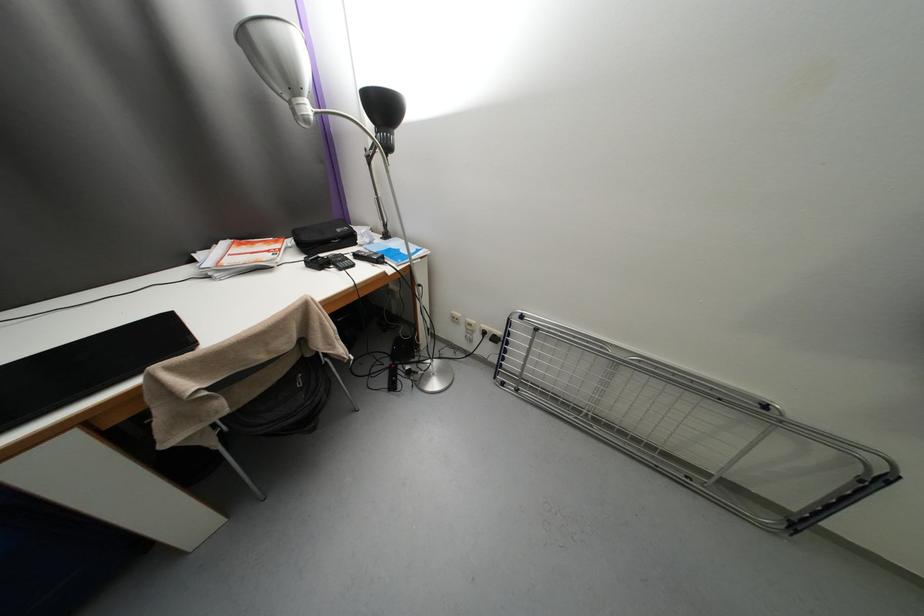
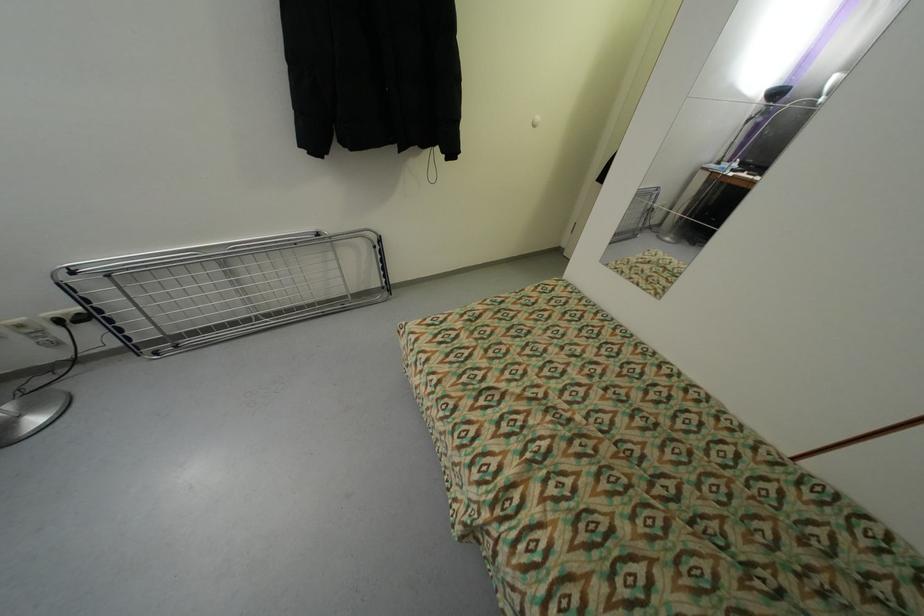
Find the pixel in the second image that matches point (477, 326) in the first image.

(27, 326)